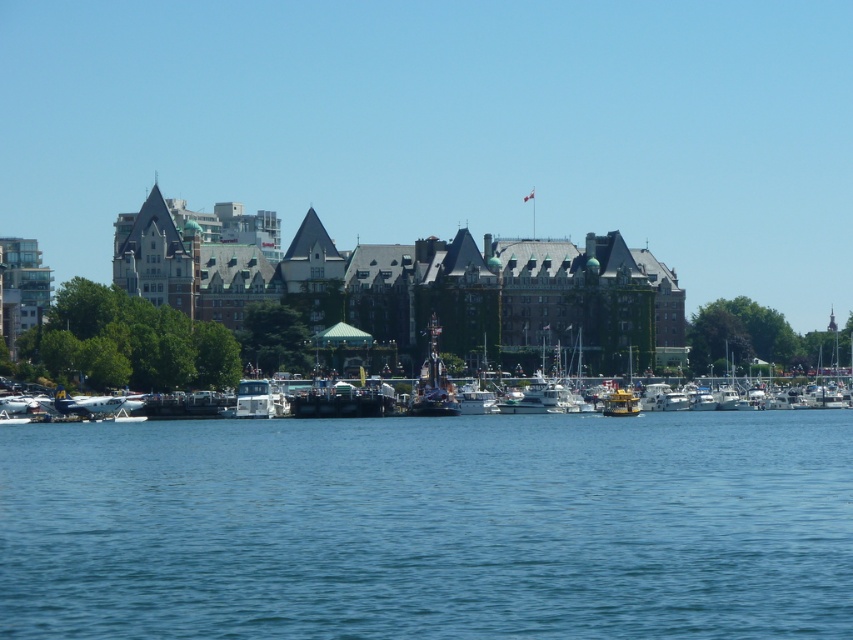
From the picture: You are a tour guide explaining the waterfront scene to visitors. You need to mention both the white glossy boat at center and the shiny silver statue at center. How far apart are they from each other?

The white glossy boat at center and the shiny silver statue at center are 10.33 meters apart.

You are standing at the point labeled as point (x=430, y=525). Looking around, you notice the blue water at center. Which direction should you face to see the blue water at center?

You should face towards the center direction to see the blue water at center, as the point (x=430, y=525) is where the blue water at center is located.

You are standing at the point marked as point [430,525]. What object is directly in front of you?

The blue water at center is located at point [430,525], so the object directly in front of you is the blue water at center.